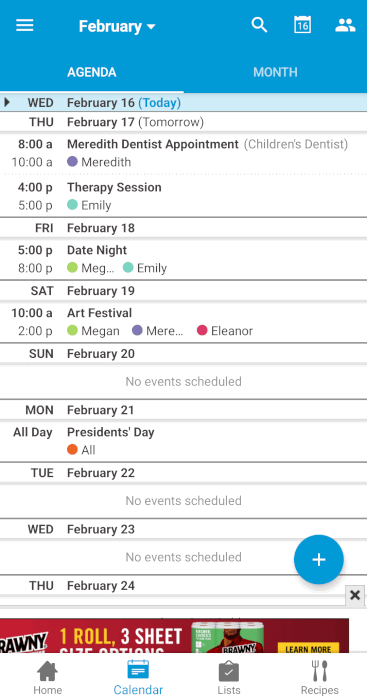
The width and height of the screenshot is (367, 700). I want to click on spoon, so pyautogui.click(x=325, y=664).